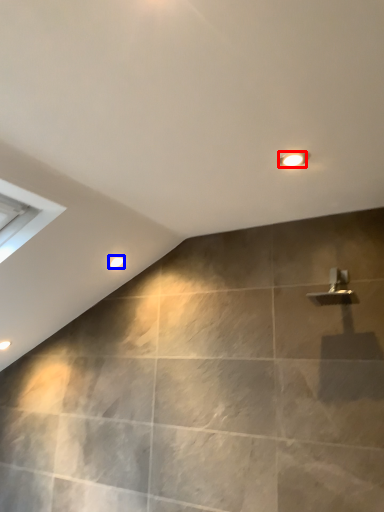
Question: Which object is further to the camera taking this photo, light fixture (highlighted by a red box) or droplight (highlighted by a blue box)?

Choices:
 (A) light fixture
 (B) droplight

Answer: (B)